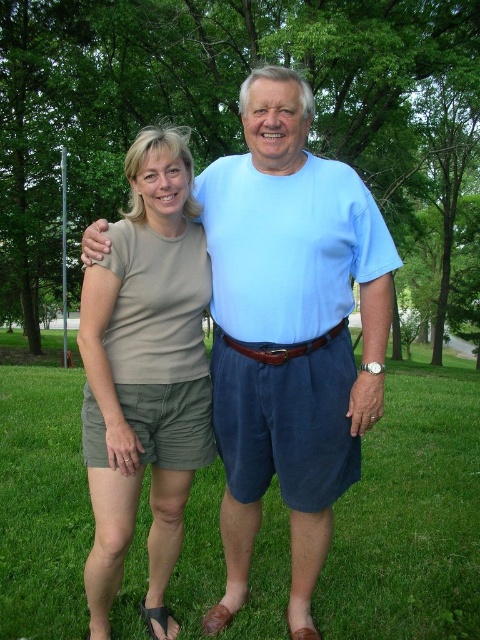
At what (x,y) coordinates should I click in order to perform the action: click on green grass at center. Please return your answer as a coordinate pair (x, y). Looking at the image, I should click on (410, 515).

Locate an element on the screen. The image size is (480, 640). green grass at center is located at coordinates (410, 515).

Between point (283, 180) and point (193, 250), which one is positioned in front?

Point (283, 180)

You are a GUI agent. You are given a task and a screenshot of the screen. Output one action in this format:
    pyautogui.click(x=<x>, y=<y>)
    Task: Click on the light blue t-shirt at center
    
    Given the screenshot: What is the action you would take?
    pyautogui.click(x=289, y=332)

I want to click on light blue t-shirt at center, so click(289, 332).

Does point (416, 586) lie in front of point (148, 413)?

No, (416, 586) is behind (148, 413).

Locate an element on the screen. This screenshot has width=480, height=640. green grass at center is located at coordinates (410, 515).

At what (x,y) coordinates should I click in order to perform the action: click on green grass at center. Please return your answer as a coordinate pair (x, y). This screenshot has height=640, width=480. Looking at the image, I should click on (410, 515).